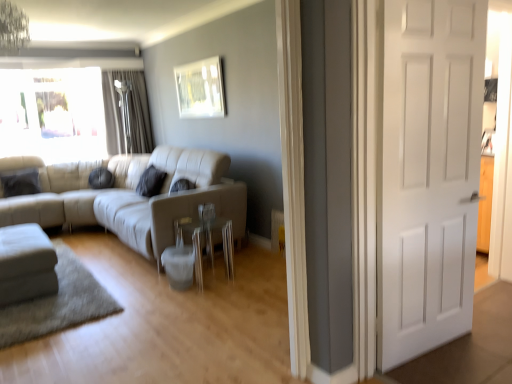
Question: From a real-world perspective, is white fabric ottoman at lower left, acting as the second studio couch starting from the right, positioned above or below dark gray fabric curtain at upper left?

Choices:
 (A) below
 (B) above

Answer: (A)

Question: From the image's perspective, is white fabric ottoman at lower left, acting as the second studio couch starting from the right, above or below dark gray fabric curtain at upper left?

Choices:
 (A) below
 (B) above

Answer: (A)

Question: Which of these objects is positioned farthest from the clear glass side table at center?

Choices:
 (A) beige leather couch at center, which is the first studio couch in right-to-left order
 (B) white matte door at right
 (C) dark gray fabric curtain at upper left
 (D) metallic silver picture frame at upper center
 (E) white fabric ottoman at lower left, acting as the second studio couch starting from the right

Answer: (C)

Question: Which object is the closest to the white matte door at right?

Choices:
 (A) dark gray fabric curtain at upper left
 (B) metallic silver picture frame at upper center
 (C) white fabric ottoman at lower left, acting as the second studio couch starting from the right
 (D) beige leather couch at center, which is the first studio couch in right-to-left order
 (E) clear glass side table at center

Answer: (E)